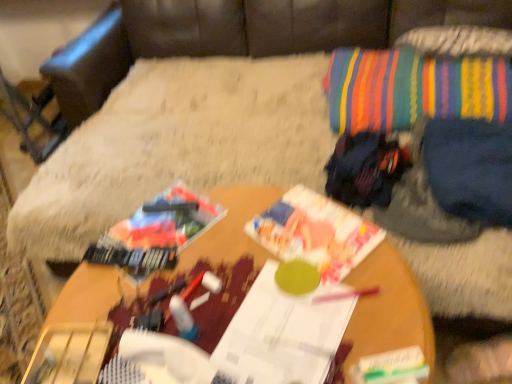
What are the coordinates of `blank space above wooden table at center (from a real-world perspective)` in the screenshot? It's located at (243, 276).